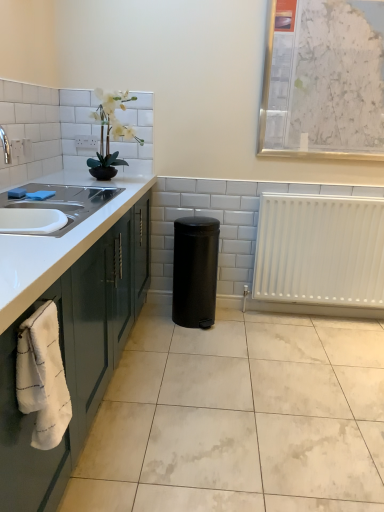
Question: From the image's perspective, does white marble bulletin board at upper right appear higher than white plastic radiator at lower right?

Choices:
 (A) yes
 (B) no

Answer: (A)

Question: Can you confirm if white marble bulletin board at upper right is wider than white plastic radiator at lower right?

Choices:
 (A) yes
 (B) no

Answer: (B)

Question: From a real-world perspective, is white marble bulletin board at upper right on top of white plastic radiator at lower right?

Choices:
 (A) yes
 (B) no

Answer: (A)

Question: From a real-world perspective, is white marble bulletin board at upper right physically below white plastic radiator at lower right?

Choices:
 (A) yes
 (B) no

Answer: (B)

Question: Is the depth of white marble bulletin board at upper right greater than that of white plastic radiator at lower right?

Choices:
 (A) no
 (B) yes

Answer: (A)

Question: From a real-world perspective, relative to white glossy countertop at left, is white plastic radiator at lower right vertically above or below?

Choices:
 (A) above
 (B) below

Answer: (A)

Question: Looking at their shapes, would you say white plastic radiator at lower right is wider or thinner than white glossy countertop at left?

Choices:
 (A) thin
 (B) wide

Answer: (A)

Question: Considering their positions, is white plastic radiator at lower right located in front of or behind white glossy countertop at left?

Choices:
 (A) behind
 (B) front

Answer: (A)

Question: Choose the correct answer: Is white plastic radiator at lower right inside white glossy countertop at left or outside it?

Choices:
 (A) inside
 (B) outside

Answer: (B)

Question: From the image's perspective, is white glossy countertop at left positioned above or below white glossy ceramic tile at lower center?

Choices:
 (A) below
 (B) above

Answer: (B)

Question: Is white glossy countertop at left situated inside white glossy ceramic tile at lower center or outside?

Choices:
 (A) outside
 (B) inside

Answer: (A)

Question: Is white glossy countertop at left taller or shorter than white glossy ceramic tile at lower center?

Choices:
 (A) tall
 (B) short

Answer: (A)

Question: Considering the positions of white glossy countertop at left and white glossy ceramic tile at lower center in the image, is white glossy countertop at left wider or thinner than white glossy ceramic tile at lower center?

Choices:
 (A) wide
 (B) thin

Answer: (B)

Question: Considering the positions of white glossy ceramic tile at lower center and white plastic radiator at lower right in the image, is white glossy ceramic tile at lower center wider or thinner than white plastic radiator at lower right?

Choices:
 (A) wide
 (B) thin

Answer: (A)

Question: Does point (165, 424) appear closer or farther from the camera than point (296, 215)?

Choices:
 (A) farther
 (B) closer

Answer: (B)